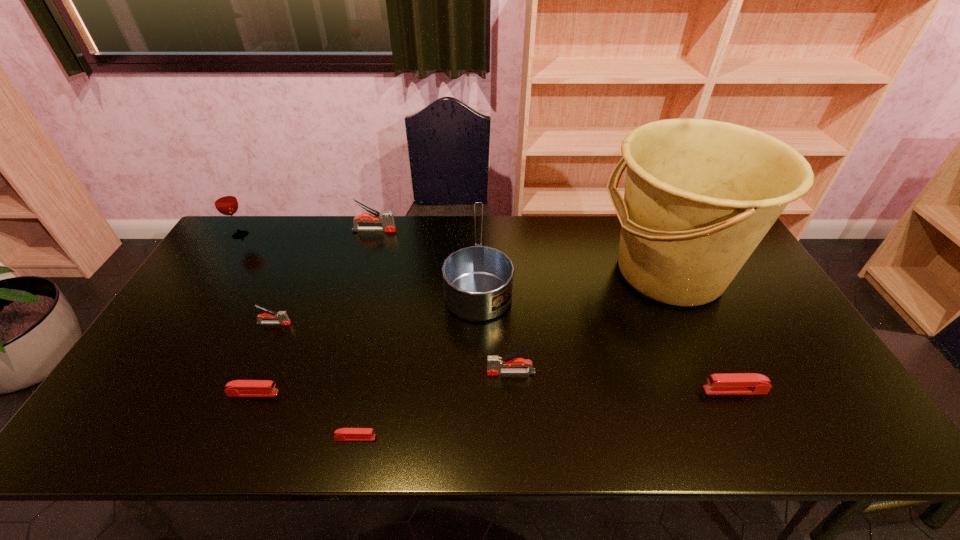
Find the location of a particular element. free space at the right edge of the desktop is located at coordinates (789, 387).

Locate an element on the screen. This screenshot has width=960, height=540. free space at the far left corner of the desktop is located at coordinates (244, 238).

Find the location of `vacant space at the near left corner of the desktop`. vacant space at the near left corner of the desktop is located at coordinates (171, 429).

Image resolution: width=960 pixels, height=540 pixels. In the image, there is a desktop. Identify the location of free region at the near right corner. (834, 413).

Locate an element on the screen. The width and height of the screenshot is (960, 540). free spot between the second tallest object and the fourth shortest stapler is located at coordinates (257, 279).

Where is `free space between the red glass and the saucepan`? This screenshot has height=540, width=960. free space between the red glass and the saucepan is located at coordinates (359, 251).

Locate an element on the screen. The height and width of the screenshot is (540, 960). unoccupied area between the leftmost object and the nearest gray stapler is located at coordinates (375, 303).

At what (x,y) coordinates should I click in order to perform the action: click on vacant point located between the shortest stapler and the second tallest object. Please return your answer as a coordinate pair (x, y). The width and height of the screenshot is (960, 540). Looking at the image, I should click on (298, 336).

Find the location of a particular element. This screenshot has width=960, height=540. free space between the leftmost red stapler and the eighth shortest object is located at coordinates (247, 314).

At what (x,y) coordinates should I click in order to perform the action: click on vacant space that is in between the second red stapler from right to left and the biggest gray stapler. Please return your answer as a coordinate pair (x, y). The height and width of the screenshot is (540, 960). Looking at the image, I should click on (365, 334).